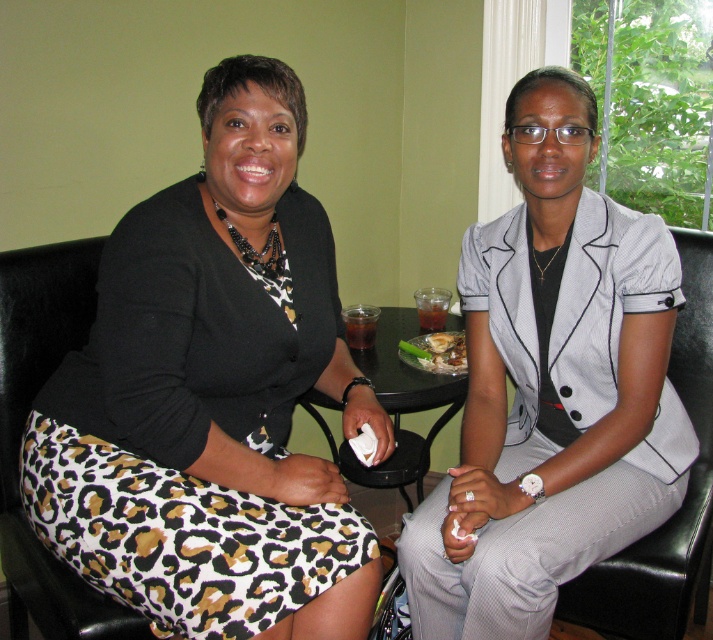
You are standing in the room and want to reach the point marked at coordinates (x=573, y=492). If you take three steps forward, each step covering 1.5 feet, will you reach the point?

The point marked at coordinates (x=573, y=492) is 4.37 feet away from you. Taking three steps of 1.5 feet each would cover 4.5 feet, so you would slightly overstep the point by 0.13 feet.

You are an interior designer analyzing the spatial layout of the image. The gray textured suit at center is positioned at a specific coordinate. Can you determine its exact 2D location in the image?

The gray textured suit at center is located at the 2D coordinate point of (553, 387).

You are standing in the room where the two women are seated. You want to place a small plant between the two points, point (x=441, y=314) and point (x=349, y=330). Which point should the plant be closer to so it is in front of the other point?

The plant should be placed closer to point (x=349, y=330) because point (x=441, y=314) is behind point (x=349, y=330), so placing the plant near the front point will ensure it is in front of the other point.